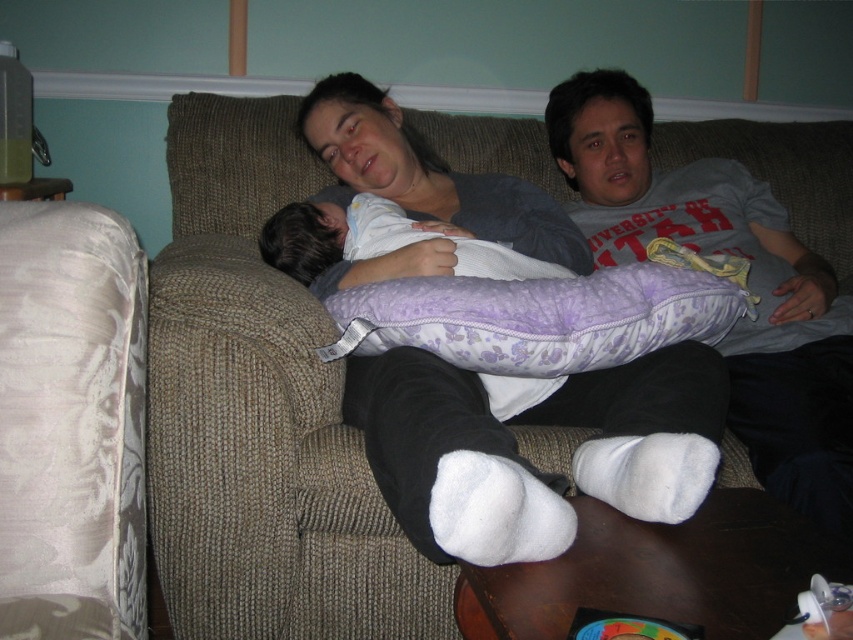
You are planning to place a new coffee table in the living room. The brown textured couch at center is at coordinates 0.647 on the x and 0.306 on the y axis. If the coffee table needs to be placed 1 meter in front of the couch, where should you position it?

The brown textured couch at center is located at point (260, 413). To place the coffee table 1 meter in front of it, you would position it at coordinates 0.647 on the x axis and 0.306 minus 1 meter on the y axis, assuming the y axis measures distance from the couch.